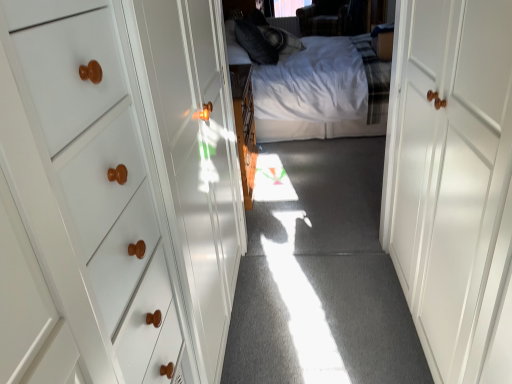
Question: Considering the positions of point (409, 291) and point (228, 36), is point (409, 291) closer or farther from the camera than point (228, 36)?

Choices:
 (A) closer
 (B) farther

Answer: (A)

Question: Is white glossy door at right in front of or behind white cotton bed at center in the image?

Choices:
 (A) behind
 (B) front

Answer: (B)

Question: Would you say white glossy door at right is to the left or to the right of white cotton bed at center in the picture?

Choices:
 (A) left
 (B) right

Answer: (B)

Question: Is point (362, 105) closer or farther from the camera than point (494, 24)?

Choices:
 (A) closer
 (B) farther

Answer: (B)

Question: From their relative heights in the image, would you say white cotton bed at center is taller or shorter than white glossy door at right?

Choices:
 (A) short
 (B) tall

Answer: (B)

Question: Is white cotton bed at center wider or thinner than white glossy door at right?

Choices:
 (A) wide
 (B) thin

Answer: (A)

Question: From a real-world perspective, is white cotton bed at center physically located above or below white glossy door at right?

Choices:
 (A) above
 (B) below

Answer: (B)